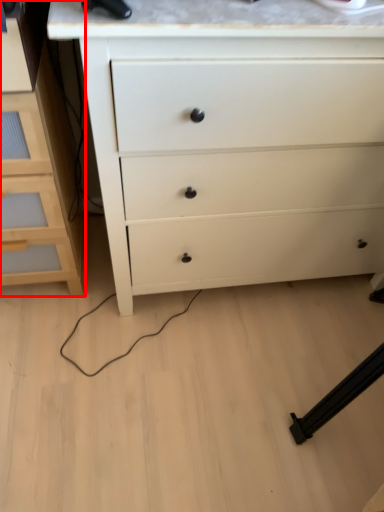
Question: From the image's perspective, considering the relative positions of chest of drawers (annotated by the red box) and chest of drawers in the image provided, where is chest of drawers (annotated by the red box) located with respect to the staircase?

Choices:
 (A) above
 (B) below

Answer: (B)